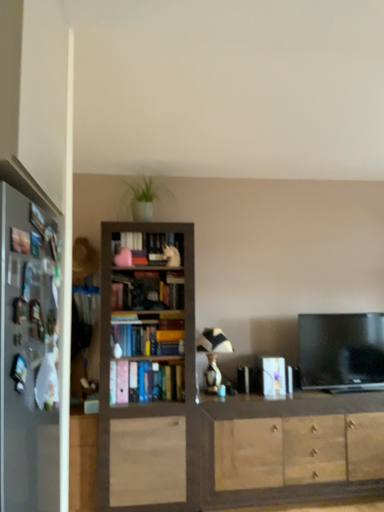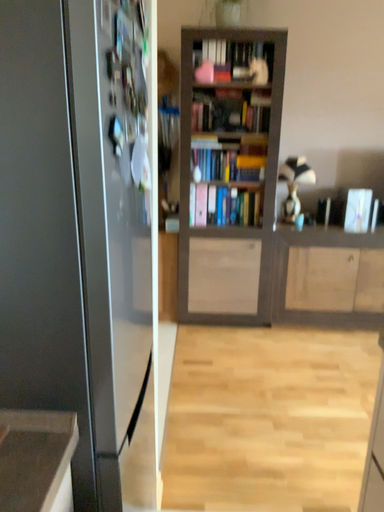
Question: How did the camera likely rotate when shooting the video?

Choices:
 (A) rotated left
 (B) rotated right

Answer: (A)